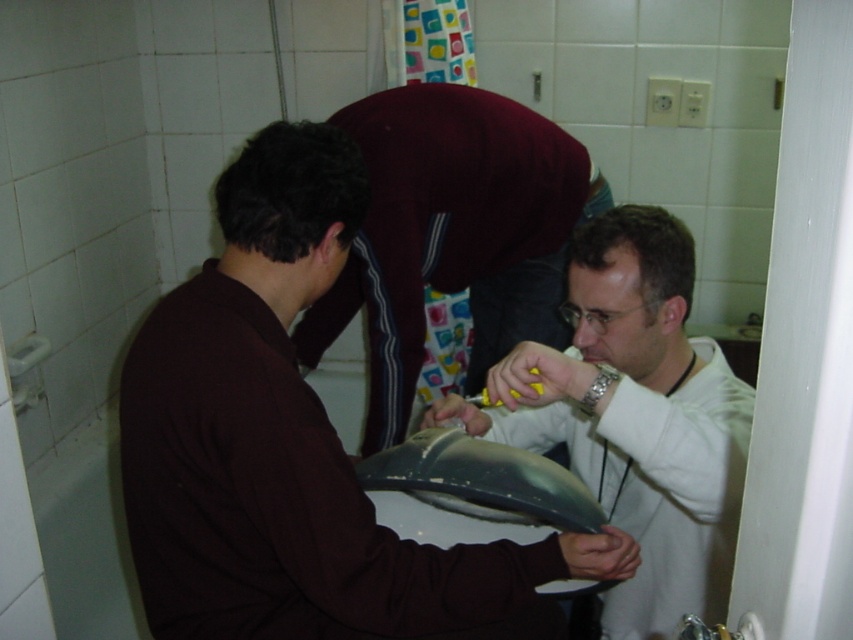
Between matte black laptop at center and metallic silver laptop at center, which one appears on the left side from the viewer's perspective?

matte black laptop at center

Is matte black laptop at center wider than metallic silver laptop at center?

Correct, the width of matte black laptop at center exceeds that of metallic silver laptop at center.

Between point (439, 589) and point (659, 355), which one is positioned in front?

Positioned in front is point (439, 589).

Identify the location of matte black laptop at center. (292, 445).

From the picture: Does matte black laptop at center have a greater height compared to maroon fabric shirt at center?

No, matte black laptop at center is not taller than maroon fabric shirt at center.

Who is shorter, matte black laptop at center or maroon fabric shirt at center?

matte black laptop at center is shorter.

In order to click on matte black laptop at center in this screenshot , I will do `click(292, 445)`.

Is metallic silver laptop at center below maroon fabric shirt at center?

Yes, metallic silver laptop at center is below maroon fabric shirt at center.

The image size is (853, 640). What do you see at coordinates (635, 417) in the screenshot?
I see `metallic silver laptop at center` at bounding box center [635, 417].

This screenshot has width=853, height=640. Find the location of `metallic silver laptop at center`. metallic silver laptop at center is located at coordinates (635, 417).